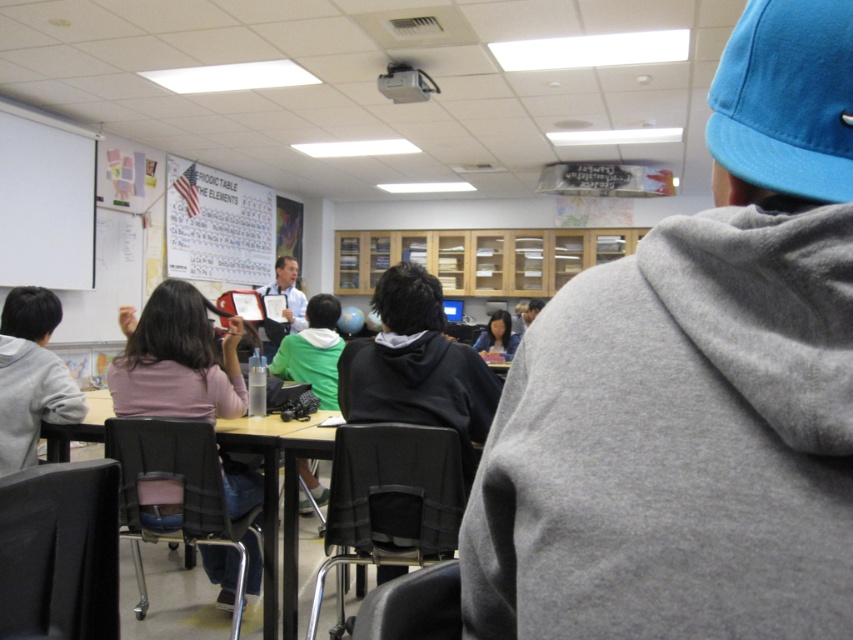
You are a student sitting at the wooden table at center and want to hand in a paper to the teacher at the front. However, your view is blocked by the blue fabric baseball cap at upper right. To your left, there is a whiteboard. Can you move to the left to avoid the cap and still see the teacher?

The blue fabric baseball cap at upper right is positioned on the right side of wooden table at center. Moving to the left towards the whiteboard might allow you to see around the cap, but since the cap is to the right of the table, moving left could provide a clearer line of sight to the teacher at the front.

Looking at this image, you are a student sitting in the classroom and need to reach a point marked at coordinates point (850, 58). If your backpack is 40 centimeters wide, can you fit it at that location?

The distance between point (850, 58) and the camera is 46.80 centimeters. Since the backpack is 40 centimeters wide, it will fit as there is enough space.

Based on the coordinates provided, where is the blue fabric cap at upper right located in the image?

The blue fabric cap at upper right is located at point coordinates of 0.609 on the x axis and 0.815 on the y axis.